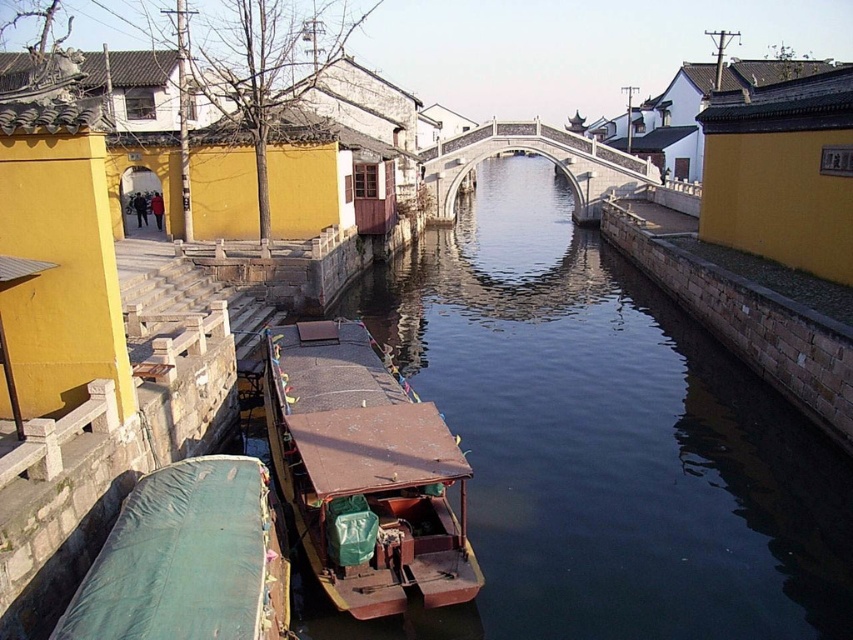
Question: Is rusty brown wooden boat at lower center below white stone bridge at center?

Choices:
 (A) yes
 (B) no

Answer: (A)

Question: Is smooth dark water at center positioned at the back of green tarpaulin boat at lower left?

Choices:
 (A) yes
 (B) no

Answer: (A)

Question: Which object is closer to the camera taking this photo?

Choices:
 (A) smooth dark water at center
 (B) rusty brown wooden boat at lower center
 (C) green tarpaulin boat at lower left
 (D) white stone bridge at center

Answer: (C)

Question: Is smooth dark water at center bigger than green tarpaulin boat at lower left?

Choices:
 (A) yes
 (B) no

Answer: (A)

Question: Which object appears closest to the camera in this image?

Choices:
 (A) white stone bridge at center
 (B) rusty brown wooden boat at lower center
 (C) smooth dark water at center

Answer: (C)

Question: Considering the real-world distances, which object is closest to the smooth dark water at center?

Choices:
 (A) green tarpaulin boat at lower left
 (B) rusty brown wooden boat at lower center

Answer: (A)